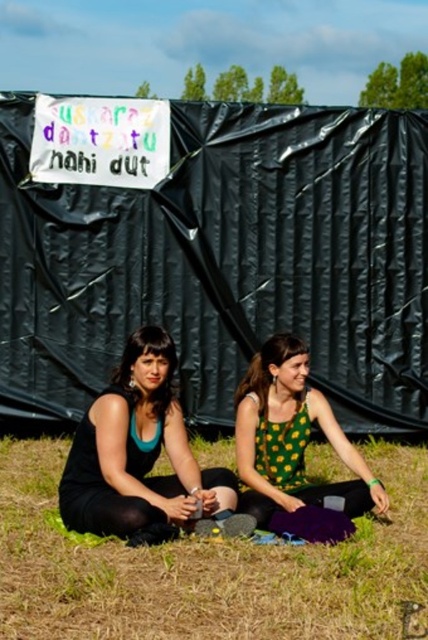
Question: Which of these objects is positioned farthest from the matte black tank top at center?

Choices:
 (A) green dotted tank top at center
 (B) green dotted dress at center
 (C) green grass at lower center

Answer: (C)

Question: Which point appears farthest from the camera in this image?

Choices:
 (A) (187, 451)
 (B) (386, 600)

Answer: (A)

Question: Among these points, which one is nearest to the camera?

Choices:
 (A) (166, 356)
 (B) (11, 554)
 (C) (297, 433)

Answer: (B)

Question: From the image, what is the correct spatial relationship of black matte tank top at center in relation to matte black tank top at center?

Choices:
 (A) right
 (B) left

Answer: (A)

Question: Is black matte tank top at center bigger than green dotted dress at center?

Choices:
 (A) no
 (B) yes

Answer: (B)

Question: Is black matte tank top at center above matte black tank top at center?

Choices:
 (A) no
 (B) yes

Answer: (A)